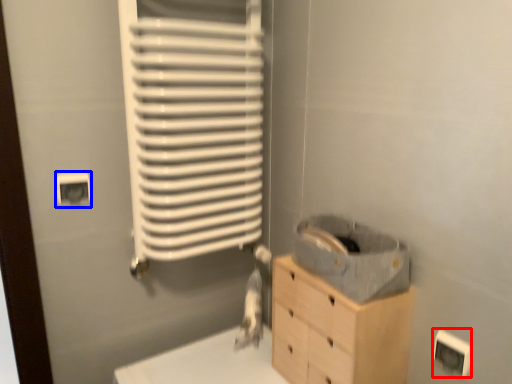
Question: Which object is further to the camera taking this photo, electric outlet (highlighted by a red box) or electric outlet (highlighted by a blue box)?

Choices:
 (A) electric outlet
 (B) electric outlet

Answer: (B)